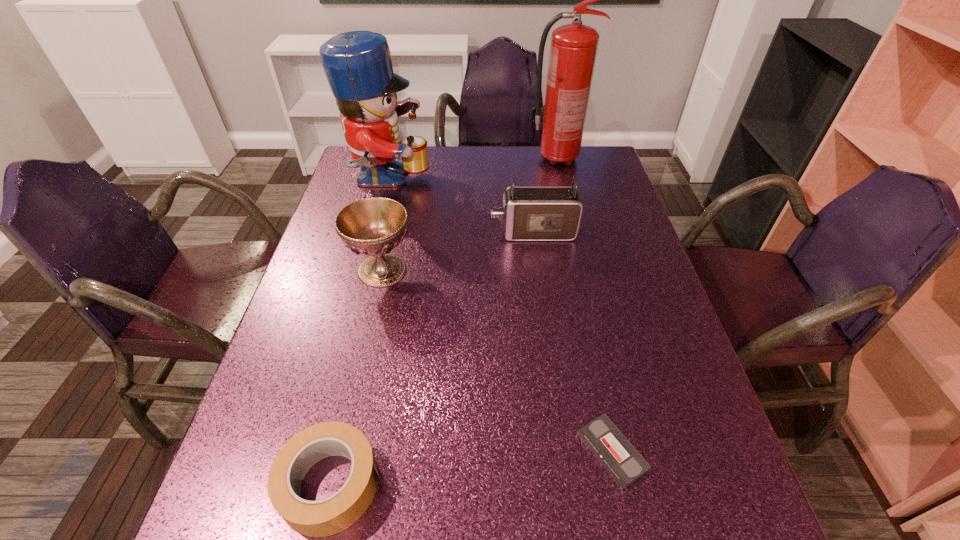
Locate an element on the screen. fire extinguisher is located at coordinates (573, 50).

In order to click on the second tallest object in this screenshot , I will do `click(358, 66)`.

The image size is (960, 540). Find the location of `camcorder`. camcorder is located at coordinates (529, 213).

Where is `the third nearest object`? the third nearest object is located at coordinates (374, 226).

The width and height of the screenshot is (960, 540). What are the coordinates of `the second shortest object` in the screenshot? It's located at (334, 514).

I want to click on videotape, so click(x=621, y=460).

Find the location of a particular element. The image size is (960, 540). free point located on the front-facing side of the fifth shortest object is located at coordinates (534, 181).

Where is `free space located at the lens of the camcorder`? This screenshot has width=960, height=540. free space located at the lens of the camcorder is located at coordinates (x=404, y=233).

Locate an element on the screen. The height and width of the screenshot is (540, 960). vacant space located at the lens of the camcorder is located at coordinates (415, 233).

At what (x,y) coordinates should I click in order to perform the action: click on vacant region located 0.360m at the lens of the camcorder. Please return your answer as a coordinate pair (x, y). Looking at the image, I should click on (361, 233).